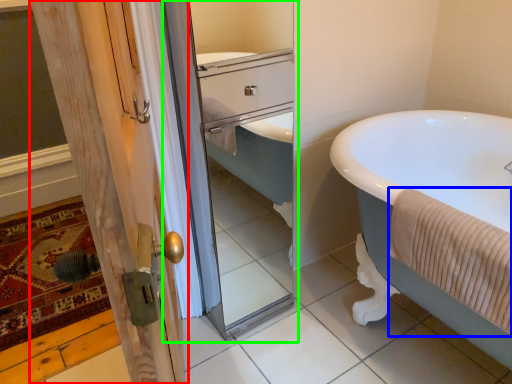
Question: Which object is positioned closest to door (highlighted by a red box)? Select from bath towel (highlighted by a blue box) and screen door (highlighted by a green box).

Choices:
 (A) bath towel
 (B) screen door

Answer: (B)